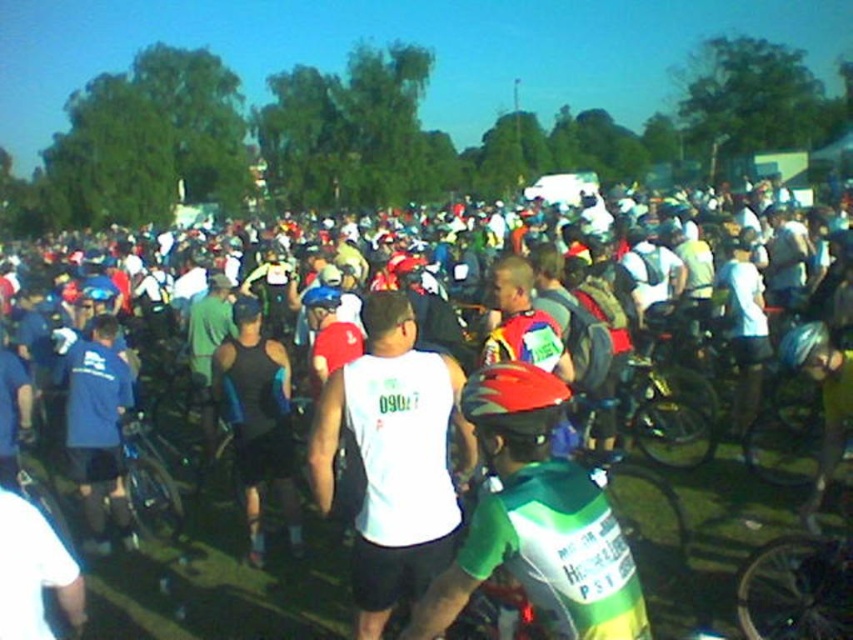
Question: Among these objects, which one is nearest to the camera?

Choices:
 (A) blue matte bicycle helmet at center-right
 (B) white matte tank top at center

Answer: (B)

Question: Which point is farther from the camera taking this photo?

Choices:
 (A) (268, 476)
 (B) (676, 420)
 (C) (537, 579)

Answer: (B)

Question: Can you confirm if black matte tank top at center is positioned above shiny red helmet at center?

Choices:
 (A) yes
 (B) no

Answer: (B)

Question: Does green jersey at center appear under blue matte bicycle helmet at center-right?

Choices:
 (A) no
 (B) yes

Answer: (B)

Question: Among these points, which one is farthest from the camera?

Choices:
 (A) (392, 381)
 (B) (825, 342)

Answer: (B)

Question: Does white matte tank top at center have a greater width compared to shiny red helmet at center?

Choices:
 (A) no
 (B) yes

Answer: (B)